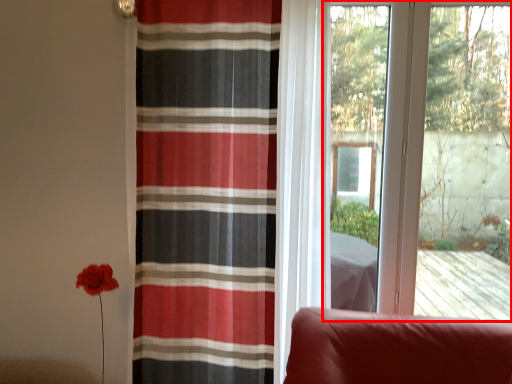
Question: Observing the image, what is the correct spatial positioning of window (annotated by the red box) in reference to curtain?

Choices:
 (A) left
 (B) right

Answer: (B)